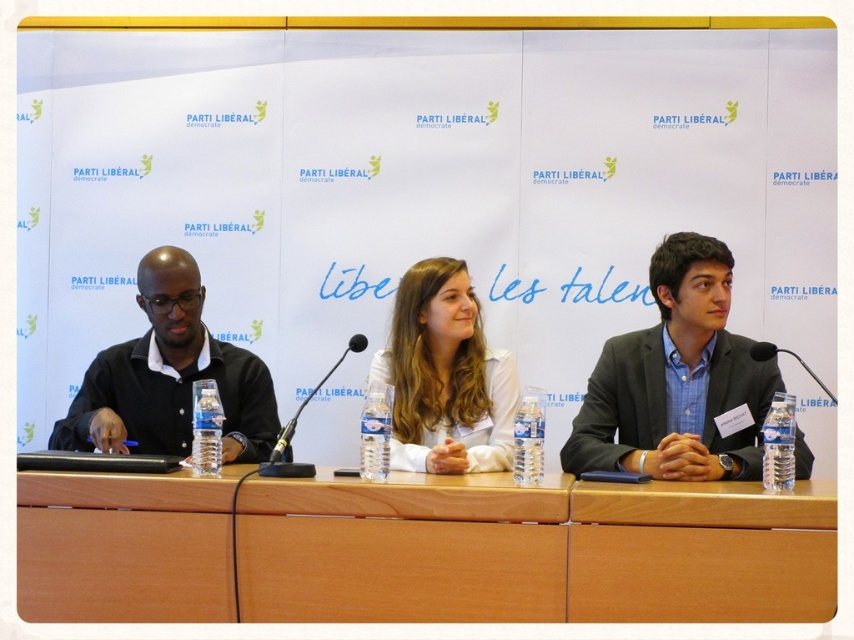
In the scene shown: You are a photographer at the event and need to ensure that both the white matte shirt at center and the black plastic microphone at center are visible in your photo. Given their sizes, which one might you need to adjust your camera focus on to ensure clarity?

The white matte shirt at center has a larger size compared to the black plastic microphone at center, so you should focus on the white matte shirt at center to ensure its details are clear.

You are attending this panel discussion and want to place a name tag on the light brown wood table at center so that it is visible to the camera positioned above the black matte shirt at left. Considering the height difference between the two objects, will the name tag be visible to the camera?

The light brown wood table at center has a lesser height compared to black matte shirt at left, so the name tag placed on the table might not be fully visible to the camera positioned above the shirt since the table is lower. Adjusting the camera angle or raising the name tag could help ensure visibility.

You are a photographer standing at the back of the room, and you want to take a closeup photo of the light brown wood table at center. The camera you have can focus on objects up to 2 meters away. Will you be able to take the photo without moving closer?

The light brown wood table at center is 1.99 meters from camera, so yes, the photographer can take the closeup photo without moving closer because the distance is within the camera focus range of 2 meters.